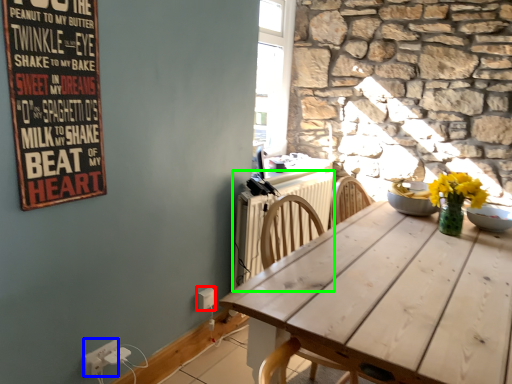
Question: Which object is positioned closest to electric outlet (highlighted by a red box)? Select from electric outlet (highlighted by a blue box) and radiator (highlighted by a green box).

Choices:
 (A) electric outlet
 (B) radiator

Answer: (A)